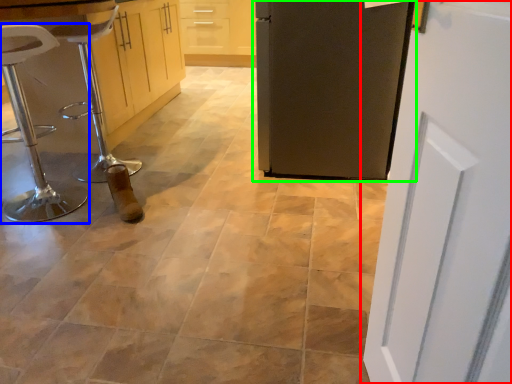
Question: Estimate the real-world distances between objects in this image. Which object is farther from door (highlighted by a red box), furniture (highlighted by a blue box) or door (highlighted by a green box)?

Choices:
 (A) furniture
 (B) door

Answer: (A)